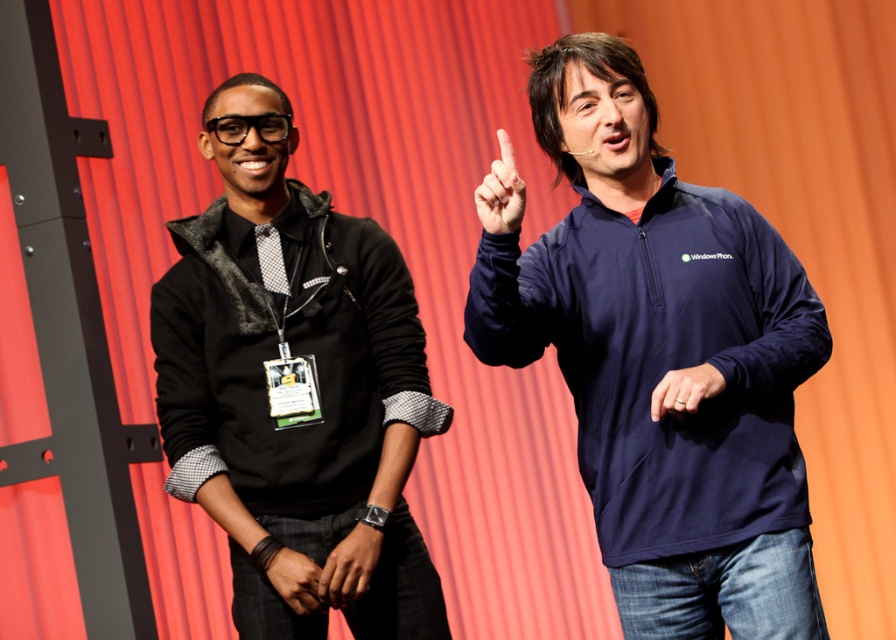
You are an event organizer who needs to ensure that all participants are properly positioned for a group photo. You notice the navy blue fleece at center and the matte blue finger at center in the image. Based on their positions, which object is closer to the bottom of the stage?

The navy blue fleece at center is located below the matte blue finger at center, so it is closer to the bottom of the stage.

You are standing in front of the stage with the vibrant red curtain. You need to locate the navy blue fleece at center. Where exactly is it positioned in terms of coordinates?

The navy blue fleece at center is positioned at coordinates point (662,358).